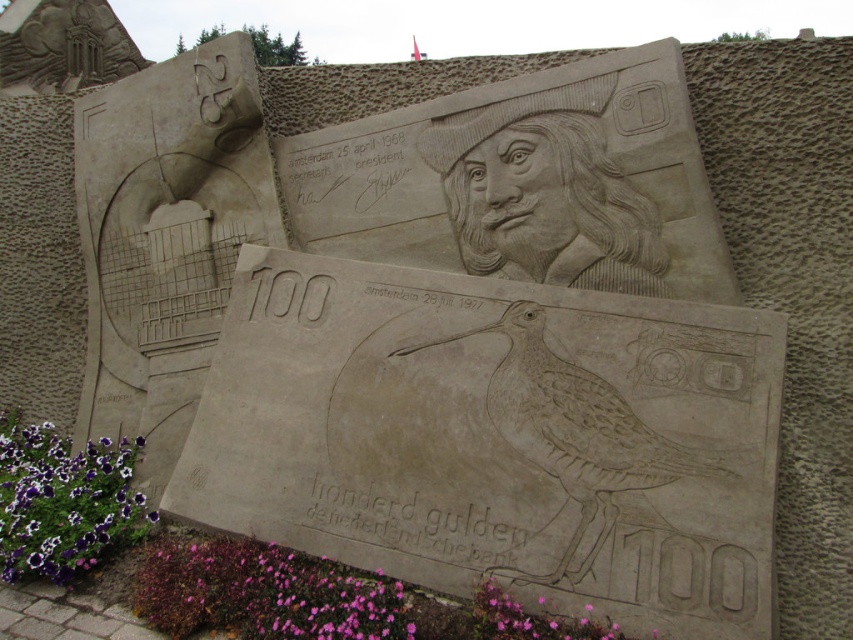
Which is behind, point (281, 608) or point (74, 468)?

The point (74, 468) is behind.

Does point (252, 612) lie in front of point (74, 572)?

That is True.

Between point (222, 593) and point (13, 502), which one is positioned behind?

The point (13, 502) is behind.

Where is `purple matte flower at lower center`? purple matte flower at lower center is located at coordinates (262, 593).

Based on the photo, can you confirm if purple matte flower at lower center is wider than pink matte flower at lower center?

Yes.

Describe the element at coordinates (262, 593) in the screenshot. I see `purple matte flower at lower center` at that location.

Find the location of `purple matte flower at lower center`. purple matte flower at lower center is located at coordinates (262, 593).

Does point (96, 524) lie behind point (618, 632)?

Yes, point (96, 524) is farther from viewer.

Is point (88, 522) positioned before point (624, 637)?

No.

Identify the location of purple petal at lower left. (64, 500).